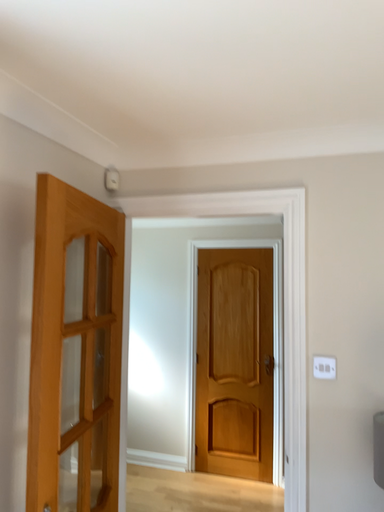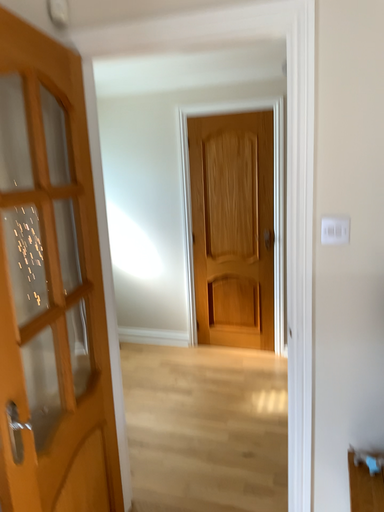
Question: Which way did the camera rotate in the video?

Choices:
 (A) rotated downward
 (B) rotated upward

Answer: (A)